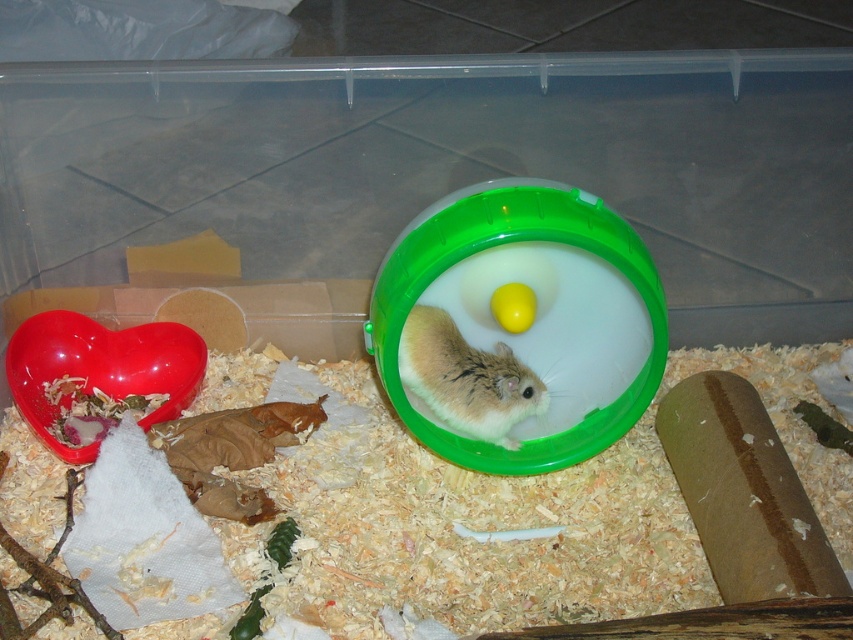
Is point (502, 380) more distant than point (523, 330)?

Yes, it is.

This screenshot has width=853, height=640. Describe the element at coordinates (466, 378) in the screenshot. I see `white fur hamster at center` at that location.

At what (x,y) coordinates should I click in order to perform the action: click on white fur hamster at center. Please return your answer as a coordinate pair (x, y). This screenshot has height=640, width=853. Looking at the image, I should click on (466, 378).